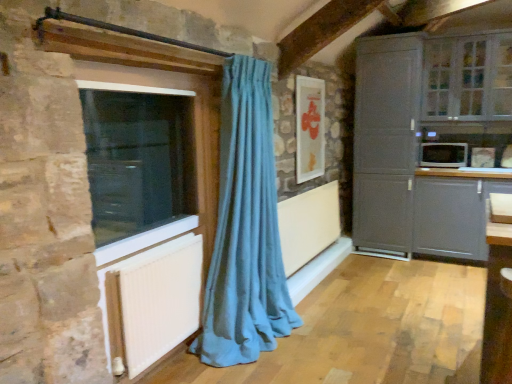
You are a GUI agent. You are given a task and a screenshot of the screen. Output one action in this format:
    pyautogui.click(x=<x>, y=<y>)
    Task: Click on the free space between matte gray cabinet at lower right and teal fabric curtain at left
    
    Given the screenshot: What is the action you would take?
    pyautogui.click(x=379, y=297)